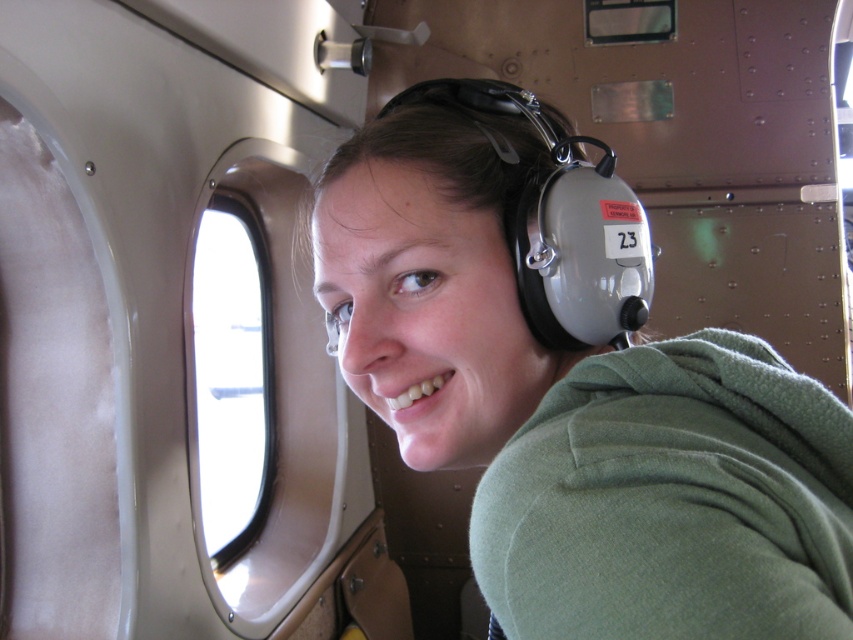
Does green fleece sweatshirt at center have a smaller size compared to transparent glass airplane window at upper left?

Yes, green fleece sweatshirt at center is smaller than transparent glass airplane window at upper left.

What do you see at coordinates (672, 500) in the screenshot? I see `green fleece sweatshirt at center` at bounding box center [672, 500].

Locate an element on the screen. The image size is (853, 640). green fleece sweatshirt at center is located at coordinates click(672, 500).

Which is behind, point (685, 456) or point (230, 456)?

Point (230, 456)

What are the coordinates of `green fleece at center` in the screenshot? It's located at (573, 403).

Between green fleece at center and green fleece sweatshirt at center, which one appears on the left side from the viewer's perspective?

From the viewer's perspective, green fleece at center appears more on the left side.

Which is below, green fleece at center or green fleece sweatshirt at center?

green fleece sweatshirt at center is lower down.

Does point (519, 353) come in front of point (476, 508)?

No, (519, 353) is further to viewer.

Identify the location of green fleece at center. (573, 403).